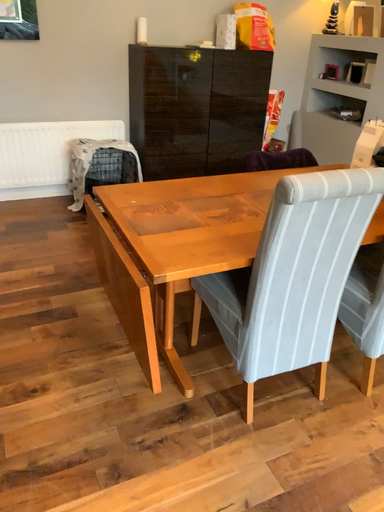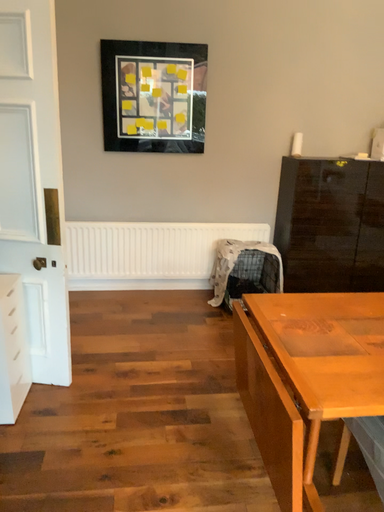
Question: How did the camera likely rotate when shooting the video?

Choices:
 (A) rotated left
 (B) rotated right

Answer: (A)